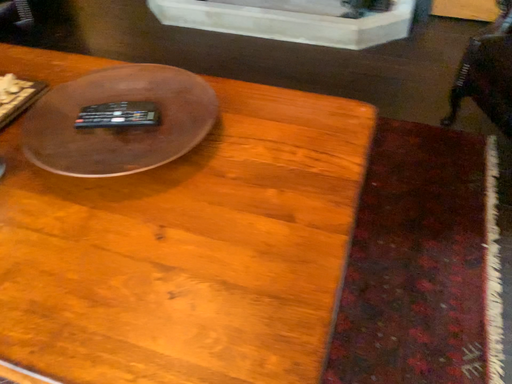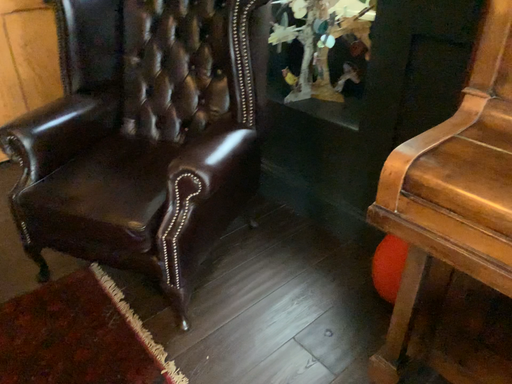
Question: Which way did the camera rotate in the video?

Choices:
 (A) rotated upward
 (B) rotated downward

Answer: (A)